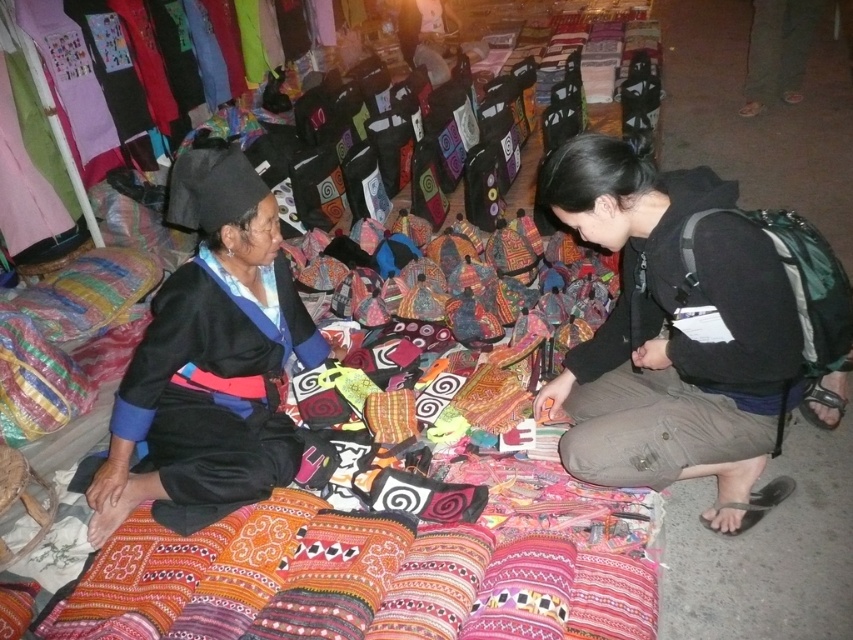
You are standing at the center of the market scene. There is a point marked at coordinates (672, 333). What object is located at this point?

The point at coordinates (672, 333) marks the location of the black cotton pants at lower right.

You are a customer at the market and want to buy both the black cotton pants at lower right and the black matte dress at left. However, you have a small backpack with limited space. Based on their sizes, which item should you place first into your backpack to ensure both fit?

The black cotton pants at lower right has a lesser height compared to the black matte dress at left, so you should place the black matte dress at left first because it is taller and needs more space.

You are a customer at the market and you want to buy a pair of pants and a dress. You see the black cotton pants at lower right and the black matte dress at left. Which item is bigger in size?

The black cotton pants at lower right is larger in size than the black matte dress at left.